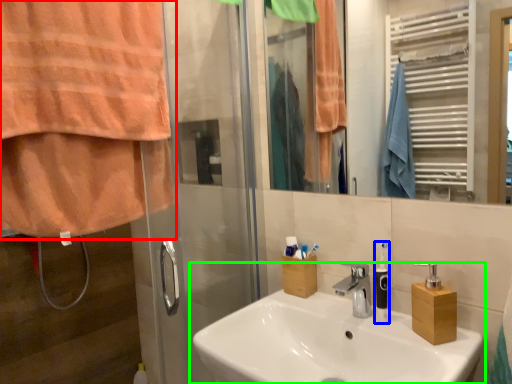
Question: Which is nearer to the curtain (highlighted by a red box)? soap dispenser (highlighted by a blue box) or sink (highlighted by a green box).

Choices:
 (A) soap dispenser
 (B) sink

Answer: (B)